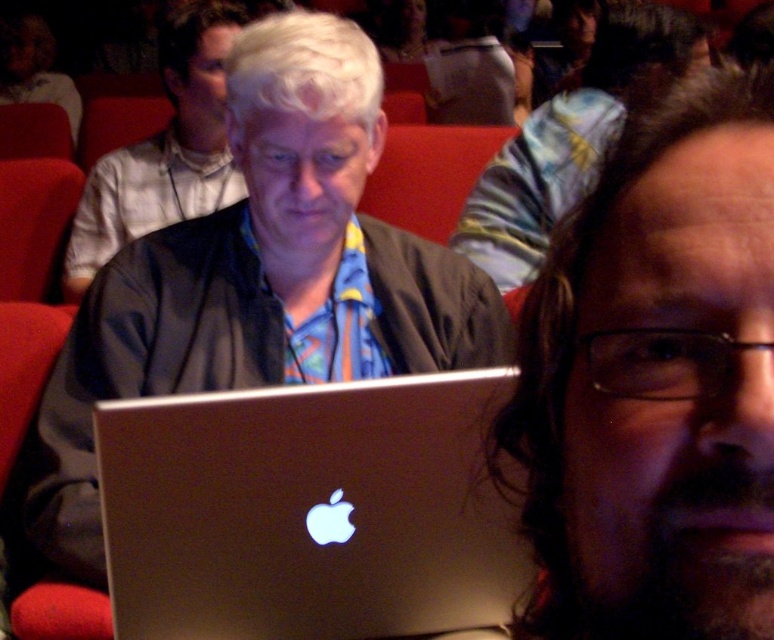
You are organizing a photo shoot and need to ensure that all objects in the frame are clearly visible. Given the scene described, which object between the dark brown hair at center and the matte black laptop at center would be easier to capture in focus due to its size?

The matte black laptop at center is larger than the dark brown hair at center, making it easier to capture in focus during the photo shoot.

You are an event organizer preparing for a presentation. You need to ensure that the silver metallic laptop at center and the blue patterned scarf at center are arranged so that the laptop is visible to the audience. Given their current positions, which object should you move to achieve this?

The silver metallic laptop at center is to the right of the blue patterned scarf at center. To ensure the laptop is visible, you should move the blue patterned scarf at center to the left so it does not block the laptop.

You are an event organizer checking the seating arrangement. You notice the silver metallic laptop at center and the striped shirt at center. Which object is closer to the front of the stage?

The silver metallic laptop at center is shorter than striped shirt at center, so the laptop is closer to the front of the stage since it appears smaller in height compared to the shirt.